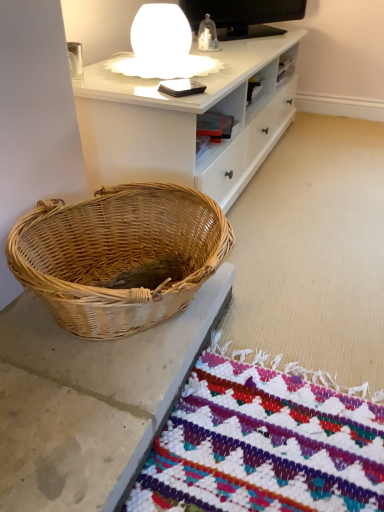
Question: Does woven natural basket at lower left appear on the right side of white matte table lamp at upper center?

Choices:
 (A) no
 (B) yes

Answer: (A)

Question: Can white matte table lamp at upper center be found inside woven natural basket at lower left?

Choices:
 (A) yes
 (B) no

Answer: (B)

Question: Is woven natural basket at lower left taller than white matte table lamp at upper center?

Choices:
 (A) no
 (B) yes

Answer: (B)

Question: Does woven natural basket at lower left come behind white matte table lamp at upper center?

Choices:
 (A) no
 (B) yes

Answer: (A)

Question: Is woven natural basket at lower left not close to white matte table lamp at upper center?

Choices:
 (A) no
 (B) yes

Answer: (A)

Question: From a real-world perspective, is woven natural basket at lower left located beneath white matte table lamp at upper center?

Choices:
 (A) no
 (B) yes

Answer: (B)

Question: Considering the relative positions of white matte table lamp at upper center and woven natural basket at lower left in the image provided, is white matte table lamp at upper center to the left of woven natural basket at lower left from the viewer's perspective?

Choices:
 (A) no
 (B) yes

Answer: (A)

Question: From a real-world perspective, is white matte table lamp at upper center physically below woven natural basket at lower left?

Choices:
 (A) no
 (B) yes

Answer: (A)

Question: Is white matte table lamp at upper center outside of woven natural basket at lower left?

Choices:
 (A) yes
 (B) no

Answer: (A)

Question: Is white matte table lamp at upper center bigger than woven natural basket at lower left?

Choices:
 (A) yes
 (B) no

Answer: (B)

Question: Is white matte table lamp at upper center wider than woven natural basket at lower left?

Choices:
 (A) yes
 (B) no

Answer: (B)

Question: Does white matte table lamp at upper center lie behind woven natural basket at lower left?

Choices:
 (A) no
 (B) yes

Answer: (B)

Question: Looking at the image, does woven natural basket at lower left seem bigger or smaller compared to white matte table lamp at upper center?

Choices:
 (A) big
 (B) small

Answer: (A)